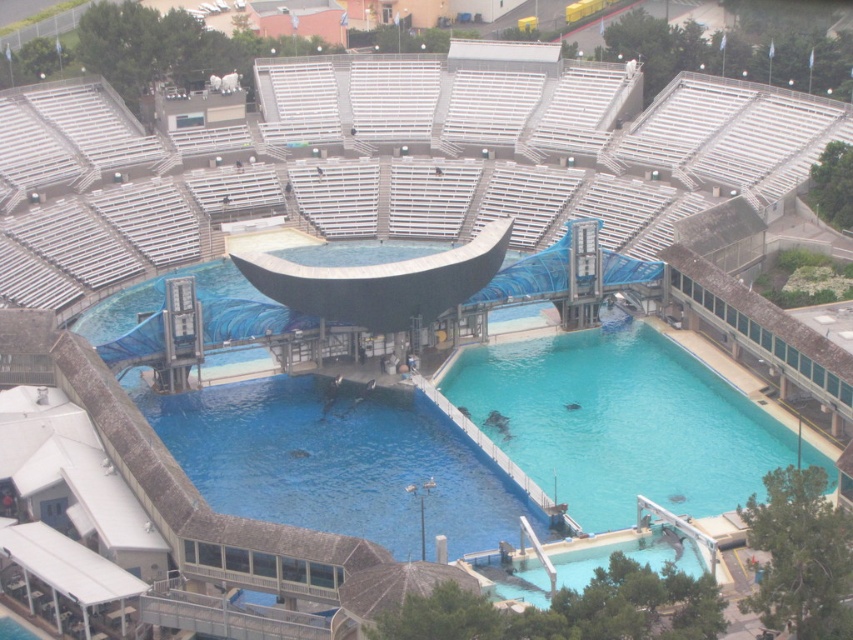
Does point (608, 349) lie behind point (201, 483)?

Yes.

Is clear blue water at center bigger than blue smooth water at center?

Indeed, clear blue water at center has a larger size compared to blue smooth water at center.

Image resolution: width=853 pixels, height=640 pixels. Identify the location of clear blue water at center. (619, 422).

Identify the location of clear blue water at center. The image size is (853, 640). [x=619, y=422].